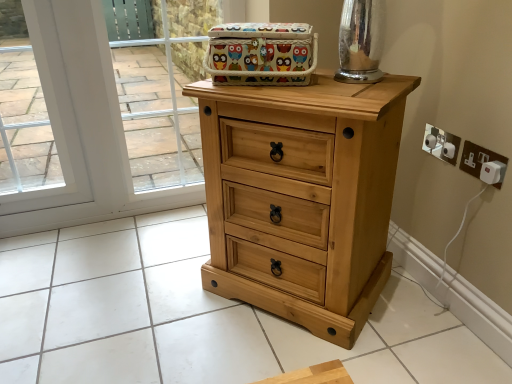
At what (x,y) coordinates should I click in order to perform the action: click on vacant space situated on the left part of natural wood chest of drawers at center. Please return your answer as a coordinate pair (x, y). Image resolution: width=512 pixels, height=384 pixels. Looking at the image, I should click on (164, 291).